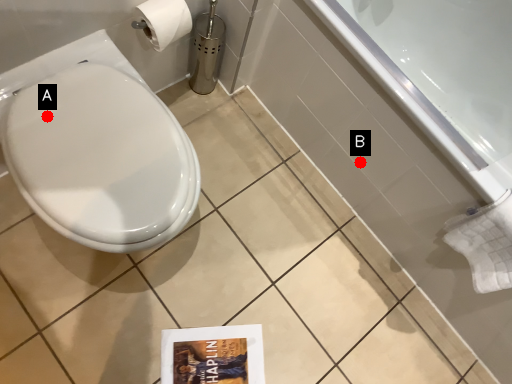
Question: Two points are circled on the image, labeled by A and B beside each circle. Which point is farther to the camera?

Choices:
 (A) A is further
 (B) B is further

Answer: (B)